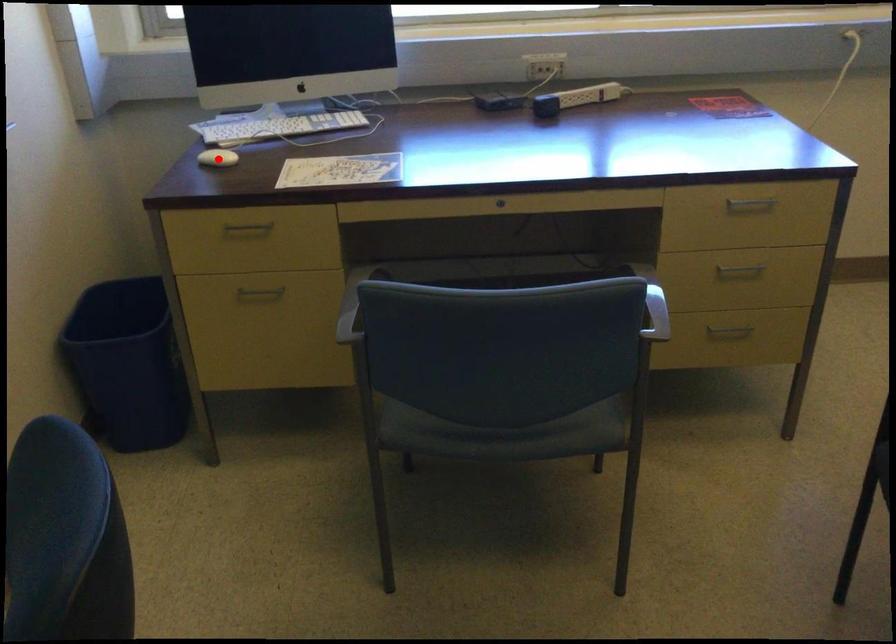
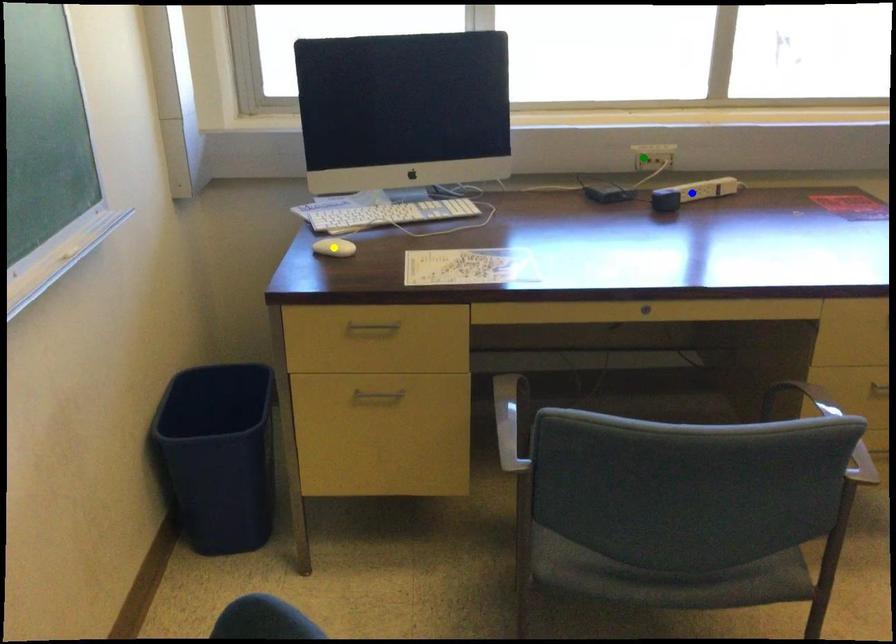
Question: I am providing you with two images of the same scene from different viewpoints. A red point is marked on the first image. You are given multiple points on the second image. Can you choose the point in image 2 that corresponds to the point in image 1?

Choices:
 (A) blue point
 (B) yellow point
 (C) green point

Answer: (B)